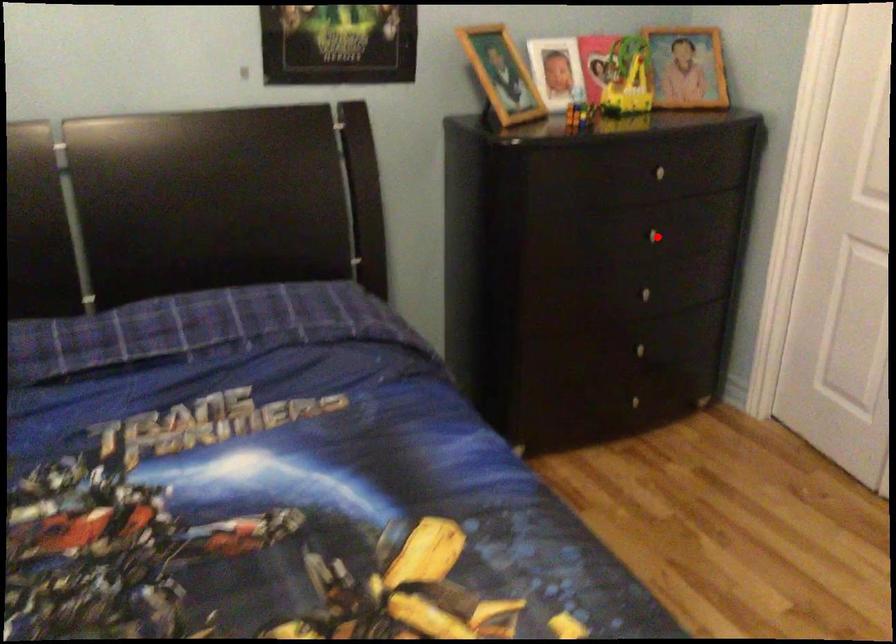
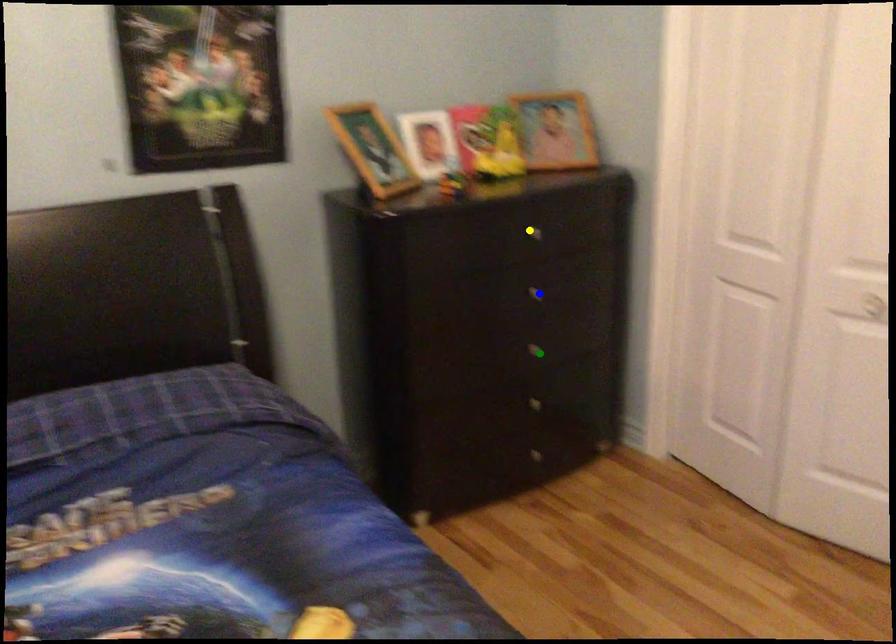
Question: I am providing you with two images of the same scene from different viewpoints. A red point is marked on the first image. You are given multiple points on the second image. In image 2, which mark is for the same physical point as the one in image 1?

Choices:
 (A) blue point
 (B) yellow point
 (C) green point

Answer: (A)